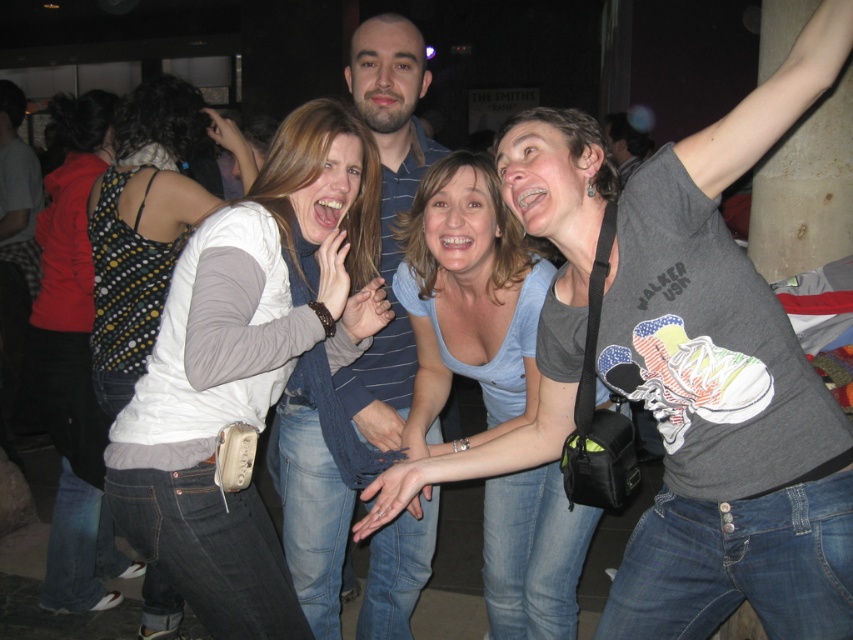
Question: Can you confirm if white matte vest at center is thinner than blue striped shirt at center?

Choices:
 (A) no
 (B) yes

Answer: (A)

Question: Which point is closer to the camera?

Choices:
 (A) (235, 538)
 (B) (113, 108)
 (C) (318, 512)

Answer: (A)

Question: Is white matte vest at center positioned before polka dot fabric top at left?

Choices:
 (A) no
 (B) yes

Answer: (B)

Question: Can you confirm if light blue denim jeans at center is positioned to the left of blue striped shirt at center?

Choices:
 (A) yes
 (B) no

Answer: (B)

Question: Which point is farther to the camera?

Choices:
 (A) (407, 232)
 (B) (65, 369)
 (C) (173, 340)

Answer: (B)

Question: Which of the following is the farthest from the observer?

Choices:
 (A) polka dot fabric top at left
 (B) blue striped shirt at center
 (C) white matte vest at center

Answer: (A)